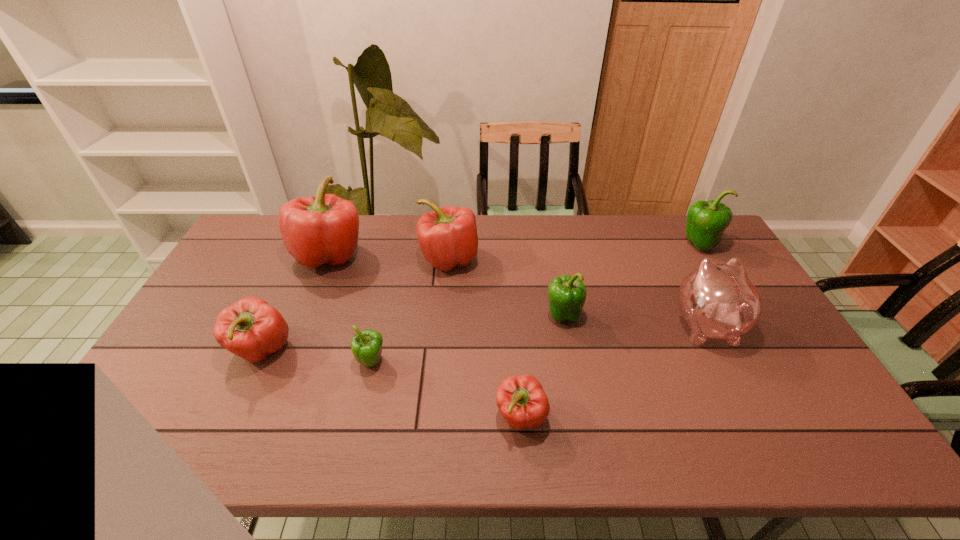
In order to click on free location that satisfies the following two spatial constraints: 1. on the back side of the rightmost pink bell pepper; 2. on the left side of the second bell pepper from right to left in this screenshot , I will do `click(514, 315)`.

Find the location of a particular element. The height and width of the screenshot is (540, 960). vacant area in the image that satisfies the following two spatial constraints: 1. on the front side of the second biggest pink bell pepper; 2. on the right side of the smallest pink bell pepper is located at coordinates (436, 417).

At what (x,y) coordinates should I click in order to perform the action: click on vacant space that satisfies the following two spatial constraints: 1. on the back side of the third biggest pink bell pepper; 2. on the right side of the biggest pink bell pepper. Please return your answer as a coordinate pair (x, y). The width and height of the screenshot is (960, 540). Looking at the image, I should click on (306, 255).

Identify the location of free location that satisfies the following two spatial constraints: 1. on the back side of the rightmost green bell pepper; 2. on the left side of the nearest bell pepper. The width and height of the screenshot is (960, 540). (508, 245).